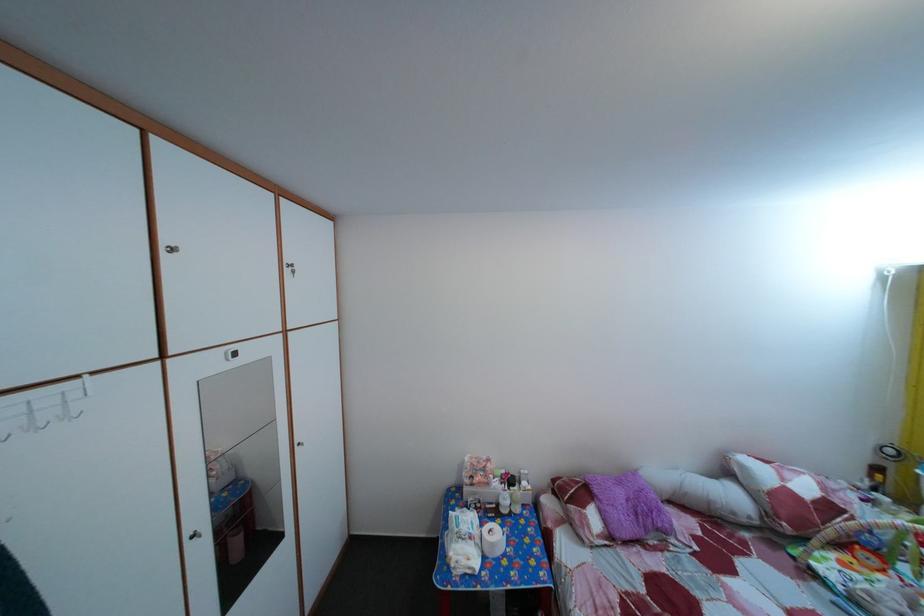
The height and width of the screenshot is (616, 924). What do you see at coordinates (298, 270) in the screenshot?
I see `the key in lock` at bounding box center [298, 270].